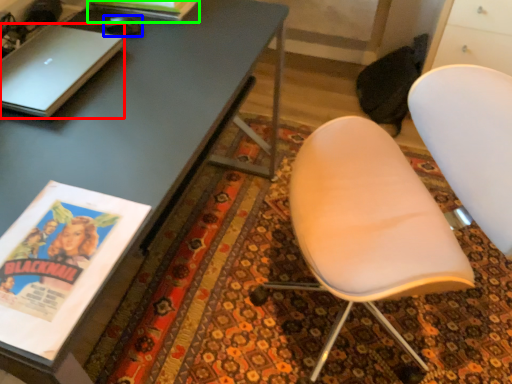
Question: Which object is positioned closest to laptop (highlighted by a red box)? Select from mouse (highlighted by a blue box) and magazine (highlighted by a green box).

Choices:
 (A) mouse
 (B) magazine

Answer: (A)